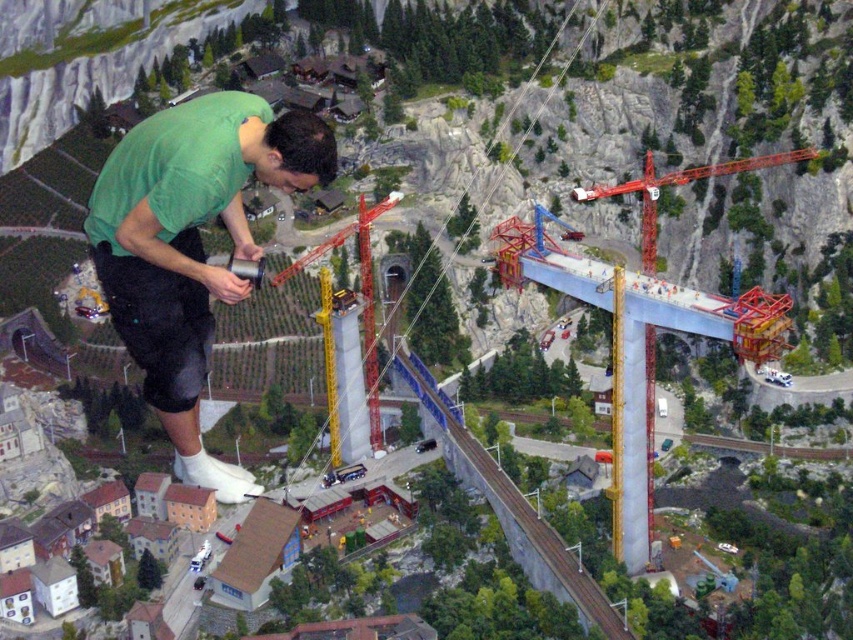
In the scene shown: You are an inspector reviewing the construction site model. You notice two points marked on the model. The first point is at coordinate point(x=200, y=186) and the second at point(x=582, y=195). Which point is located closer to your viewpoint as you examine the model?

Point(x=200, y=186) is closer to the viewer than point(x=582, y=195).

You are a visitor observing the construction site model. You notice a green matte shirt at upper left and a yellow metallic crane at center. Which object appears shorter in the model?

The green matte shirt at upper left is shorter than the yellow metallic crane at center.

You are an engineer analyzing the construction site layout. You need to determine the exact coordinates of the orange metallic crane at upper right. What are its coordinates?

The orange metallic crane at upper right is located at coordinates point (677, 184).